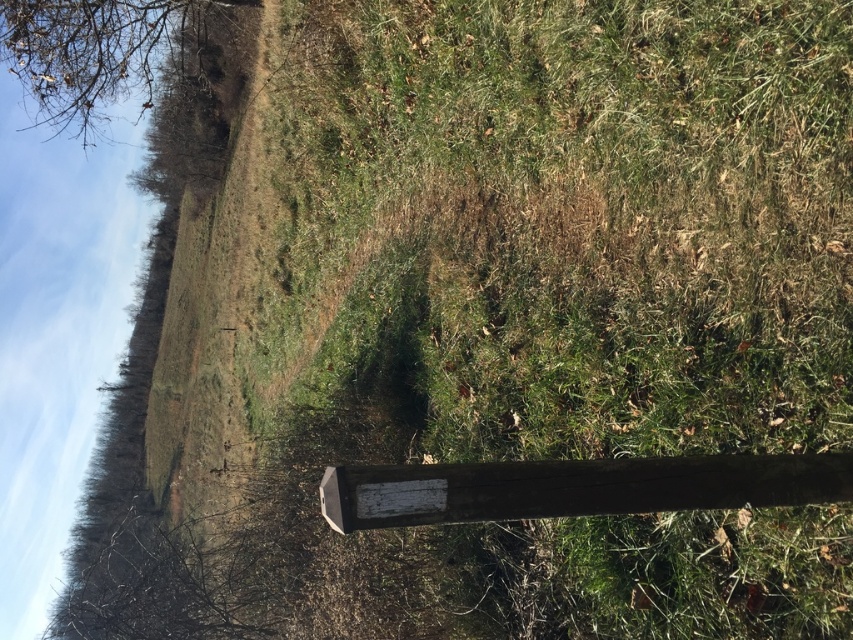
Does weathered wood signpost at lower center come behind brown bark tree at upper left?

No, it is in front of brown bark tree at upper left.

Does point (474, 509) come behind point (105, 96)?

No.

Locate an element on the screen. weathered wood signpost at lower center is located at coordinates coord(573,486).